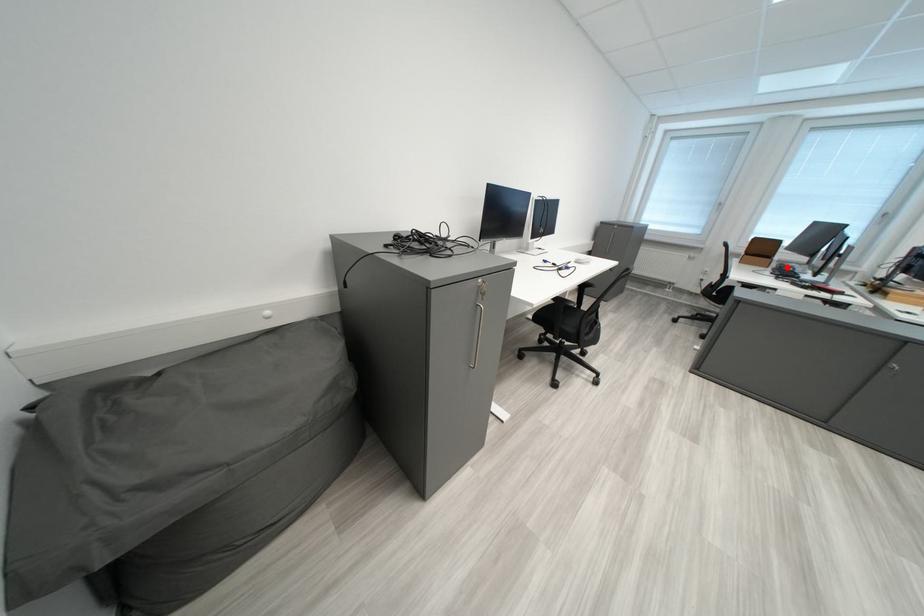
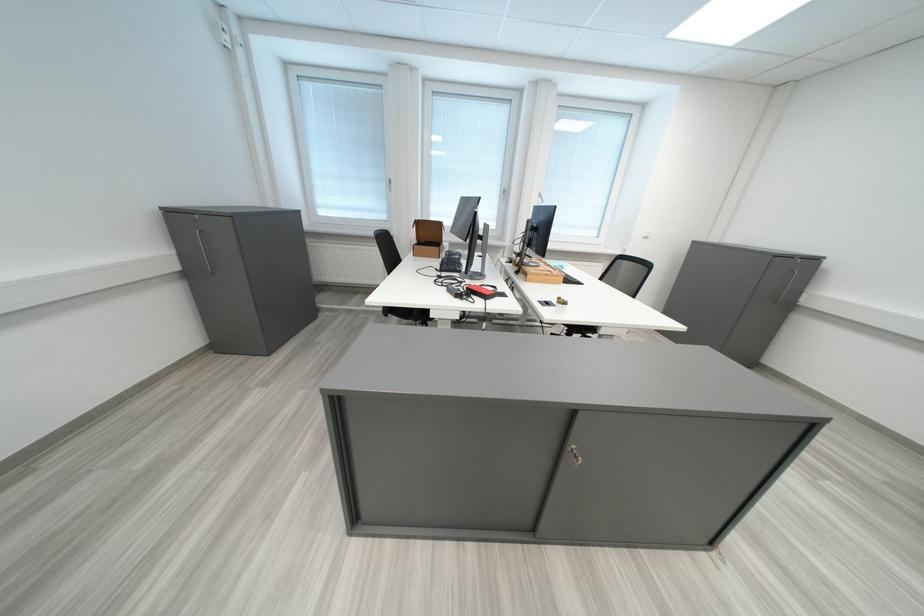
Where in the second image is the point corresponding to the highlighted location from the first image?

(456, 256)